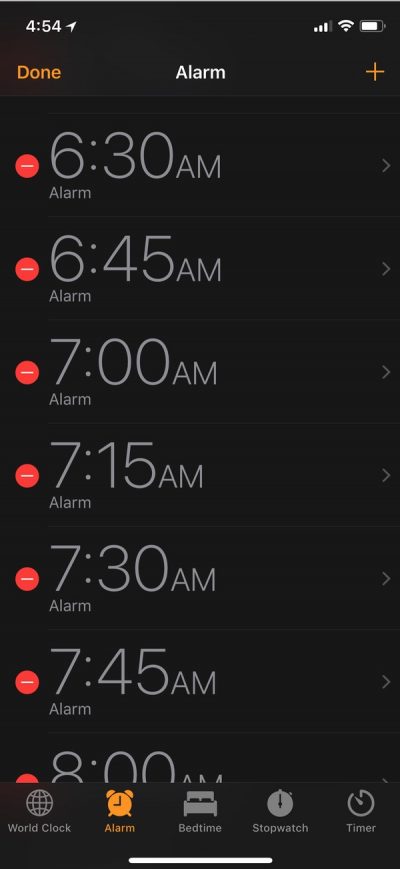
Image resolution: width=400 pixels, height=869 pixels. Identify the location of timer. (360, 806).